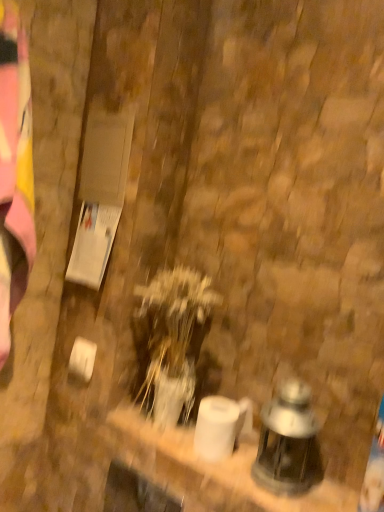
Where is `matte glass lantern at lower right`? matte glass lantern at lower right is located at coordinates (288, 442).

Describe the element at coordinates (288, 442) in the screenshot. I see `matte glass lantern at lower right` at that location.

This screenshot has width=384, height=512. What do you see at coordinates (176, 328) in the screenshot?
I see `translucent glass vase at center` at bounding box center [176, 328].

The image size is (384, 512). Identify the location of translucent glass vase at center. (176, 328).

At what (x,y) coordinates should I click in order to perform the action: click on matte glass lantern at lower right. Please return your answer as a coordinate pair (x, y). Looking at the image, I should click on (288, 442).

Is matte glass lantern at lower right to the right of translucent glass vase at center from the viewer's perspective?

Yes.

Is matte glass lantern at lower right in front of or behind translucent glass vase at center in the image?

Clearly, matte glass lantern at lower right is in front of translucent glass vase at center.

Is point (315, 449) behind point (172, 329)?

No, (315, 449) is closer to viewer.

From the image's perspective, between matte glass lantern at lower right and translucent glass vase at center, which one is located above?

translucent glass vase at center, from the image's perspective.

From a real-world perspective, relative to translucent glass vase at center, is matte glass lantern at lower right vertically above or below?

In terms of real-world spatial position, matte glass lantern at lower right is below translucent glass vase at center.

Does matte glass lantern at lower right have a greater width compared to translucent glass vase at center?

No, matte glass lantern at lower right is not wider than translucent glass vase at center.

Which of these two, matte glass lantern at lower right or translucent glass vase at center, stands taller?

With more height is translucent glass vase at center.

Who is smaller, matte glass lantern at lower right or translucent glass vase at center?

matte glass lantern at lower right.

Is matte glass lantern at lower right outside of translucent glass vase at center?

matte glass lantern at lower right lies outside translucent glass vase at center's area.

Is matte glass lantern at lower right not near translucent glass vase at center?

No, matte glass lantern at lower right is not far from translucent glass vase at center.

Does matte glass lantern at lower right turn towards translucent glass vase at center?

No, matte glass lantern at lower right is not turned towards translucent glass vase at center.

Where is `lantern lying in front of the translucent glass vase at center`? The width and height of the screenshot is (384, 512). lantern lying in front of the translucent glass vase at center is located at coordinates (288, 442).

In the scene shown: Between translucent glass vase at center and matte glass lantern at lower right, which one appears on the left side from the viewer's perspective?

translucent glass vase at center.

Which object is closer to the camera taking this photo, translucent glass vase at center or matte glass lantern at lower right?

matte glass lantern at lower right.

Which is nearer, (175, 371) or (285, 415)?

Point (175, 371) is positioned farther from the camera compared to point (285, 415).

From the image's perspective, does translucent glass vase at center appear lower than matte glass lantern at lower right?

No.

In the scene shown: From a real-world perspective, who is located lower, translucent glass vase at center or matte glass lantern at lower right?

matte glass lantern at lower right is physically lower.

Between translucent glass vase at center and matte glass lantern at lower right, which one has smaller width?

matte glass lantern at lower right.

Between translucent glass vase at center and matte glass lantern at lower right, which one has more height?

Standing taller between the two is translucent glass vase at center.

Does translucent glass vase at center have a larger size compared to matte glass lantern at lower right?

Yes, translucent glass vase at center is bigger than matte glass lantern at lower right.

Does translucent glass vase at center contain matte glass lantern at lower right?

No, matte glass lantern at lower right is not a part of translucent glass vase at center.

Are translucent glass vase at center and matte glass lantern at lower right far apart?

translucent glass vase at center is actually quite close to matte glass lantern at lower right.

Is translucent glass vase at center looking in the opposite direction of matte glass lantern at lower right?

translucent glass vase at center does not have its back to matte glass lantern at lower right.

You are a GUI agent. You are given a task and a screenshot of the screen. Output one action in this format:
    pyautogui.click(x=<x>, y=<y>)
    Task: Click on the lantern to the right of translucent glass vase at center
    This screenshot has width=384, height=512.
    Given the screenshot: What is the action you would take?
    pyautogui.click(x=288, y=442)

You are a GUI agent. You are given a task and a screenshot of the screen. Output one action in this format:
    pyautogui.click(x=<x>, y=<y>)
    Task: Click on the plant on the left of matte glass lantern at lower right
    
    Given the screenshot: What is the action you would take?
    pyautogui.click(x=176, y=328)

The width and height of the screenshot is (384, 512). Find the location of `plant behind the matte glass lantern at lower right`. plant behind the matte glass lantern at lower right is located at coordinates (176, 328).